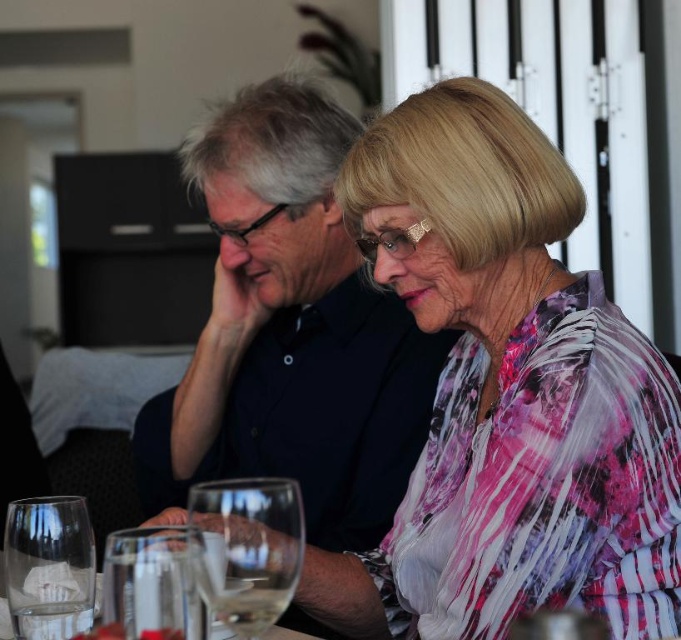
You are standing in front of the dining table where the two individuals are seated. You need to place a small vase exactly at the center of the table. The pink floral blouse at center is currently located at point 0.602, 0.756. Is the blouse positioned at the exact center of the table?

The pink floral blouse at center is located at point (513, 385). Since the exact center of the table would be at coordinates (340, 320), the blouse is not positioned at the exact center of the table.

You are standing in front of the dining table where two people are sitting. You need to determine which of the two points, point (558, 202) or point (187, 628), is closer to you. Which one is closer?

Point (558, 202) is closer to you because it is further to the viewer than point (187, 628).